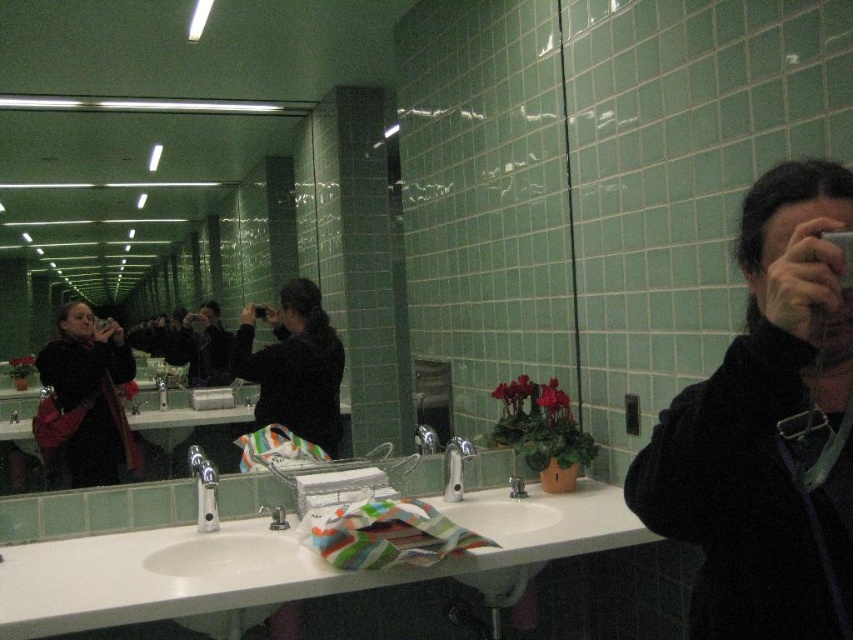
Question: Which of the following is the farthest from the observer?

Choices:
 (A) matte black jacket at left
 (B) white glossy sink at center
 (C) black fabric jacket at center

Answer: (C)

Question: Does black fabric at right appear under white glossy sink at center?

Choices:
 (A) no
 (B) yes

Answer: (A)

Question: Can you confirm if matte black jacket at left is wider than brushed metal faucet at sink center?

Choices:
 (A) no
 (B) yes

Answer: (B)

Question: Estimate the real-world distances between objects in this image. Which object is farther from the brushed metal faucet at sink left?

Choices:
 (A) black fabric at right
 (B) white glossy sink at center
 (C) brushed metal faucet at sink center

Answer: (A)

Question: Is black fabric jacket at center positioned before white glossy sink at center?

Choices:
 (A) no
 (B) yes

Answer: (A)

Question: Which point is closer to the camera?

Choices:
 (A) white glossy sink at center
 (B) black fabric jacket at center
 (C) silver metallic faucet at sink center

Answer: (A)